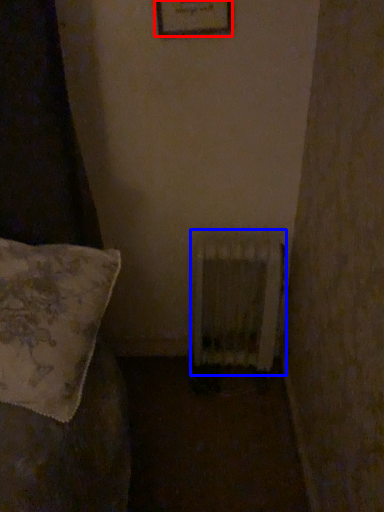
Question: Which of the following is the closest to the observer, picture frame (highlighted by a red box) or radiator (highlighted by a blue box)?

Choices:
 (A) picture frame
 (B) radiator

Answer: (A)